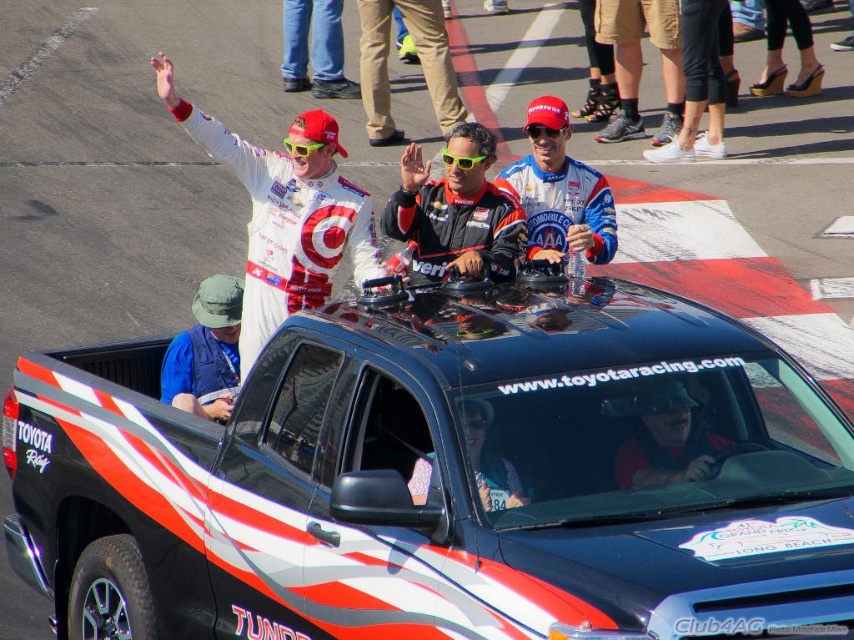
You are standing at the event and want to take a photo of the black matte racing suit at center. If your camera can focus up to 8 meters, will you be able to capture a clear image?

The black matte racing suit at center is 8.57 meters away from the viewer. Since the camera can only focus up to 8 meters, it won the focus range. Therefore, you won capture a clear image.

You are a photographer standing in front of the black Toyota Tundra pickup truck. You need to capture a photo that includes both the black matte racing suit at center and the black leather helmet at center. Which object should you frame wider to ensure both are fully visible in the photo?

The black matte racing suit at center is wider than the black leather helmet at center, so you should frame the black matte racing suit at center wider to ensure both are fully visible in the photo.

You are a photographer at the event and want to capture both the black matte racing suit at center and the green fabric hat at left in a single photo. Which object should you focus on first to ensure both are in frame?

The black matte racing suit at center is larger in size than the green fabric hat at left, so focusing on the black matte racing suit at center first will ensure both are in frame.